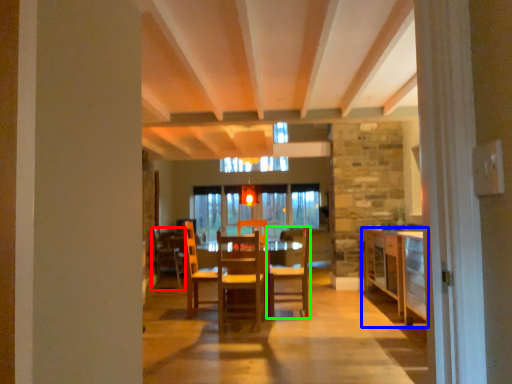
Question: Which object is positioned closest to chair (highlighted by a red box)? Select from cabinetry (highlighted by a blue box) and chair (highlighted by a green box).

Choices:
 (A) cabinetry
 (B) chair

Answer: (B)